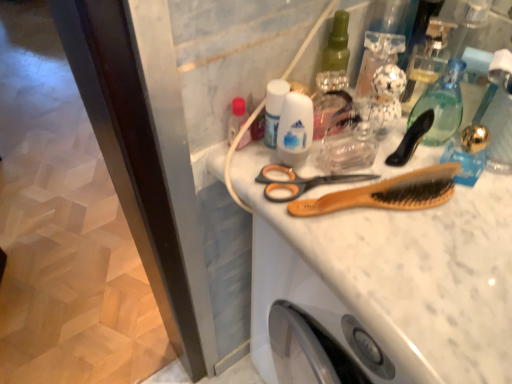
I want to click on vacant area to the right of orange plastic scissors at center, so click(443, 219).